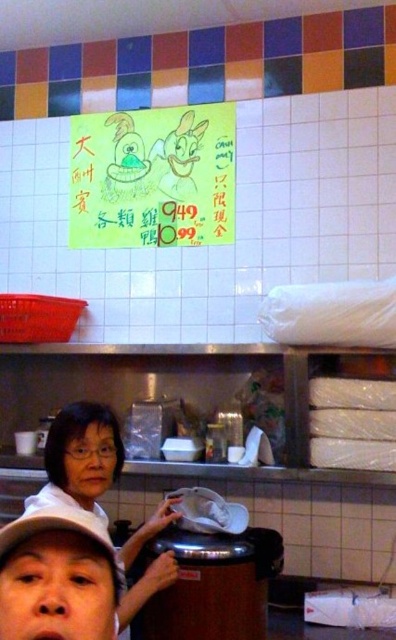
You are a customer entering the restaurant and see the green paper sign at upper center and the matte white shirt at center. Which object is positioned higher in the image?

The green paper sign at upper center is positioned higher than the matte white shirt at center.

You are a customer who just entered the restaurant and want to read the menu displayed on the green paper sign at upper center. To do so, where should you position yourself relative to the matte white shirt at center?

You should position yourself to the left of the matte white shirt at center so that the green paper sign at upper center becomes visible to the right.